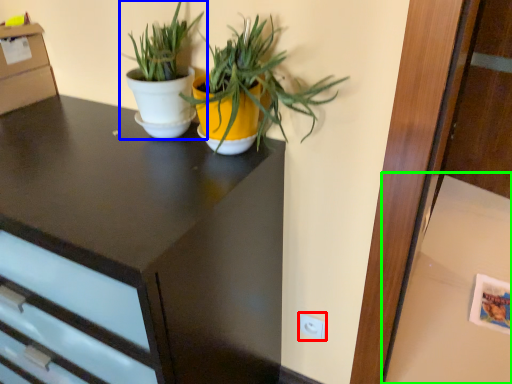
Question: Which object is positioned closest to electric outlet (highlighted by a red box)? Select from houseplant (highlighted by a blue box) and table (highlighted by a green box).

Choices:
 (A) houseplant
 (B) table

Answer: (A)